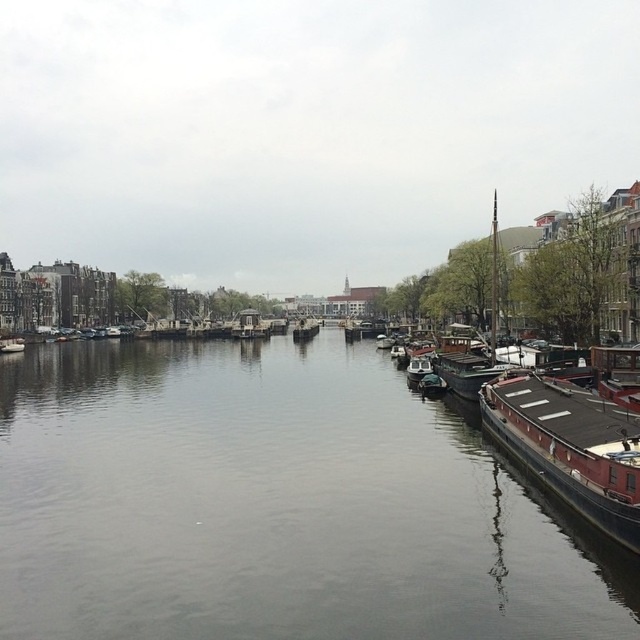
You are standing on a bridge overlooking the canal and want to determine which object, the smooth water at center or the brown wooden barge at right, is higher from the ground level. Based on the scene, can you tell?

The smooth water at center has a greater height compared to the brown wooden barge at right, so the smooth water at center is higher from the ground level.

You are standing on a bridge overlooking the canal. You see the smooth water at center and the brown wooden barge at right. Which object is closer to the left side of the bridge?

The smooth water at center is closer to the left side of the bridge because it is positioned to the left of the brown wooden barge at right.

You are navigating a small boat along the canal in the scene. You notice two points marked on your map at coordinates point (x=24, y=360) and point (x=580, y=465). If you are facing the direction of the canal leading away from the buildings, which point should you steer towards to stay closer to the buildings?

You should steer towards point (x=580, y=465) because it is in front of point (x=24, y=360). Since you want to stay closer to the buildings, the point that is in front when facing the canal away from the buildings would be nearer to the structures lining the waterway.